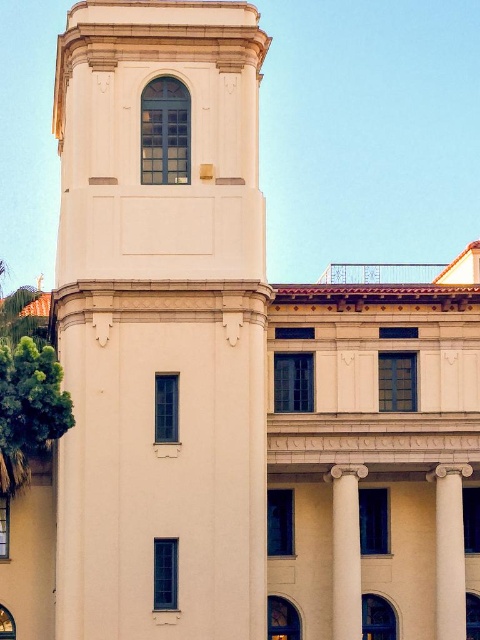
Which of these two, white smooth column at right or white marble column at center, stands shorter?

white marble column at center is shorter.

The image size is (480, 640). Describe the element at coordinates (450, 550) in the screenshot. I see `white smooth column at right` at that location.

I want to click on white smooth column at right, so click(450, 550).

Is white smooth tower at center smaller than white marble column at center?

No, white smooth tower at center is not smaller than white marble column at center.

Image resolution: width=480 pixels, height=640 pixels. I want to click on white smooth tower at center, so click(160, 321).

The height and width of the screenshot is (640, 480). I want to click on white smooth tower at center, so click(160, 321).

Find the location of a particular element. The width and height of the screenshot is (480, 640). white smooth tower at center is located at coordinates (160, 321).

Between white smooth tower at center and white smooth column at right, which one is positioned lower?

white smooth column at right is below.

Is point (68, 112) positioned behind point (451, 502)?

That is True.

Locate an element on the screen. This screenshot has width=480, height=640. white smooth tower at center is located at coordinates tap(160, 321).